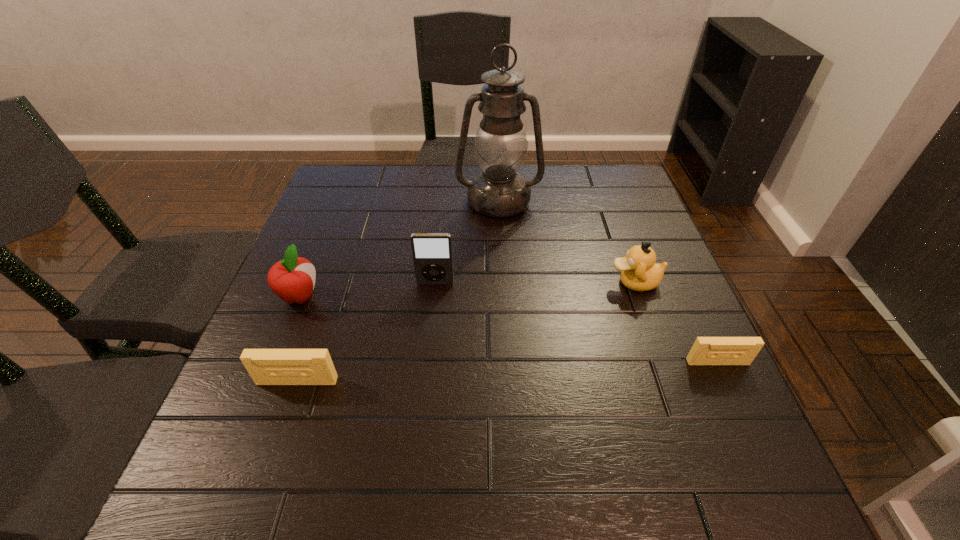
Find the location of a particular element. the nearer videotape is located at coordinates (266, 366).

Locate an element on the screen. This screenshot has width=960, height=540. the taller videotape is located at coordinates (266, 366).

Find the location of a particular element. This screenshot has height=540, width=960. the shorter videotape is located at coordinates [x=706, y=350].

At what (x,y) coordinates should I click in order to perform the action: click on the farther videotape. Please return your answer as a coordinate pair (x, y). Image resolution: width=960 pixels, height=540 pixels. Looking at the image, I should click on (706, 350).

Locate an element on the screen. the tallest object is located at coordinates (501, 144).

Image resolution: width=960 pixels, height=540 pixels. I want to click on oil lamp, so point(501,144).

Where is `iPod`? The image size is (960, 540). iPod is located at coordinates (432, 253).

I want to click on duckling, so click(x=639, y=272).

Find the location of a particular element. apple is located at coordinates (292, 279).

Find the location of `blank area located 0.100m at the front of the taller videotape with spools`. blank area located 0.100m at the front of the taller videotape with spools is located at coordinates (277, 438).